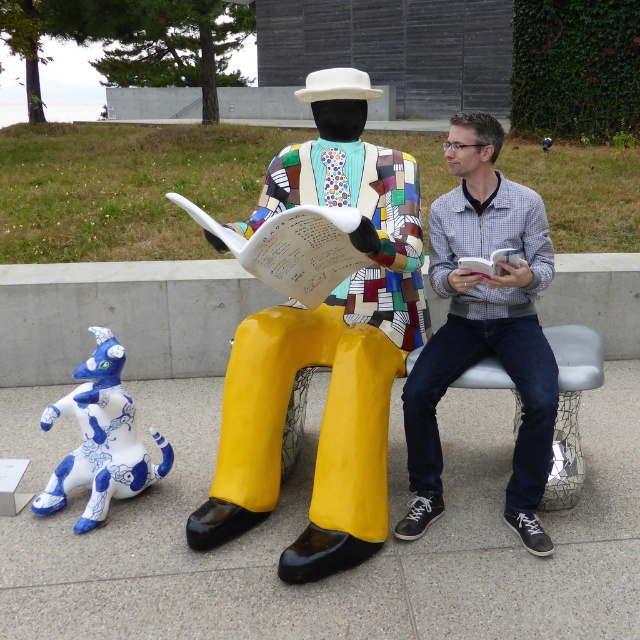
Does matte gray shirt at center appear under blue glossy ceramic dog at lower left?

Actually, matte gray shirt at center is above blue glossy ceramic dog at lower left.

Is matte gray shirt at center positioned behind blue glossy ceramic dog at lower left?

No, matte gray shirt at center is in front of blue glossy ceramic dog at lower left.

You are a GUI agent. You are given a task and a screenshot of the screen. Output one action in this format:
    pyautogui.click(x=<x>, y=<y>)
    Task: Click on the matte gray shirt at center
    The image size is (640, 640).
    Given the screenshot: What is the action you would take?
    pyautogui.click(x=484, y=324)

This screenshot has height=640, width=640. Identify the location of matte gray shirt at center. (484, 324).

Is point (323, 138) positioned behind point (525, 506)?

Yes, it is.

Between matte multicolored suit at center and matte gray shirt at center, which one is positioned lower?

matte gray shirt at center is below.

This screenshot has height=640, width=640. Find the location of `matte multicolored suit at center`. matte multicolored suit at center is located at coordinates point(324,346).

Who is more distant from viewer, (387, 346) or (88, 426)?

Point (88, 426)

Can you confirm if matte multicolored suit at center is smaller than blue glossy ceramic dog at lower left?

Actually, matte multicolored suit at center might be larger than blue glossy ceramic dog at lower left.

Identify the location of matte multicolored suit at center. Image resolution: width=640 pixels, height=640 pixels. (324, 346).

The width and height of the screenshot is (640, 640). In order to click on matte multicolored suit at center in this screenshot , I will do `click(324, 346)`.